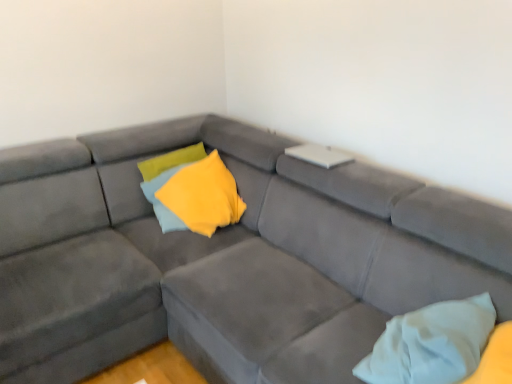
Question: From the image's perspective, is suede gray couch at center located beneath yellow soft fabric pillow at center, positioned as the second pillow in bottom-to-top order?

Choices:
 (A) no
 (B) yes

Answer: (B)

Question: Can you confirm if suede gray couch at center is wider than yellow soft fabric pillow at center, which appears as the second pillow when viewed from the right?

Choices:
 (A) no
 (B) yes

Answer: (B)

Question: From a real-world perspective, is suede gray couch at center beneath yellow soft fabric pillow at center, positioned as the second pillow in bottom-to-top order?

Choices:
 (A) no
 (B) yes

Answer: (B)

Question: Is suede gray couch at center to the right of yellow soft fabric pillow at center, the first pillow from the back, from the viewer's perspective?

Choices:
 (A) yes
 (B) no

Answer: (A)

Question: Does suede gray couch at center turn towards yellow soft fabric pillow at center, which is the 2th pillow in front-to-back order?

Choices:
 (A) yes
 (B) no

Answer: (A)

Question: Can you confirm if suede gray couch at center is positioned to the left of yellow soft fabric pillow at center, positioned as the second pillow in bottom-to-top order?

Choices:
 (A) yes
 (B) no

Answer: (B)

Question: Is white soft pillow at lower right, the 2th pillow viewed from the back, looking in the opposite direction of suede gray couch at center?

Choices:
 (A) no
 (B) yes

Answer: (B)

Question: Can you confirm if white soft pillow at lower right, the first pillow from the bottom, is smaller than suede gray couch at center?

Choices:
 (A) no
 (B) yes

Answer: (B)

Question: Is white soft pillow at lower right, the 2th pillow viewed from the back, shorter than suede gray couch at center?

Choices:
 (A) no
 (B) yes

Answer: (B)

Question: Is white soft pillow at lower right, acting as the second pillow starting from the top, positioned beyond the bounds of suede gray couch at center?

Choices:
 (A) no
 (B) yes

Answer: (A)

Question: Is white soft pillow at lower right, acting as the second pillow starting from the top, at the right side of suede gray couch at center?

Choices:
 (A) yes
 (B) no

Answer: (A)

Question: Is white soft pillow at lower right, placed as the second pillow when sorted from left to right, positioned before suede gray couch at center?

Choices:
 (A) yes
 (B) no

Answer: (B)

Question: Are yellow soft fabric pillow at center, the first pillow from the back, and white soft pillow at lower right, acting as the second pillow starting from the top, located far from each other?

Choices:
 (A) yes
 (B) no

Answer: (A)